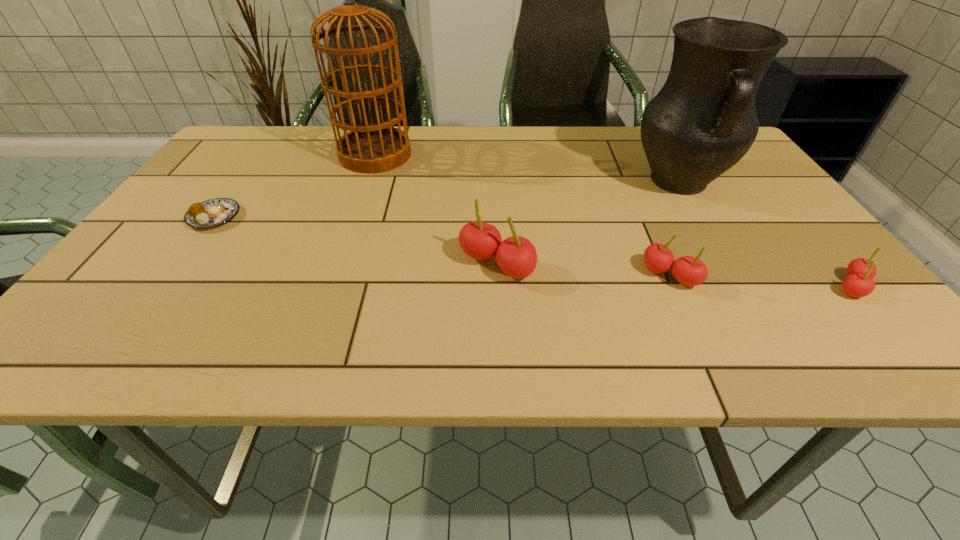
Please point a vacant point for placing a cherry on the left. Please provide its 2D coordinates. Your answer should be formatted as a tuple, i.e. [(x, y)], where the tuple contains the x and y coordinates of a point satisfying the conditions above.

[(331, 255)]